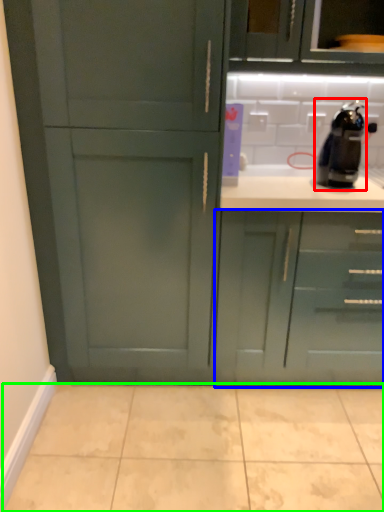
Question: Which object is the closest to the coffee machine (highlighted by a red box)? Choose among these: cabinetry (highlighted by a blue box) or ceramic tile (highlighted by a green box).

Choices:
 (A) cabinetry
 (B) ceramic tile

Answer: (A)